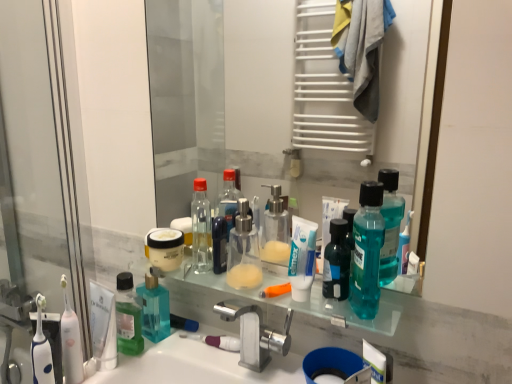
Question: From a real-world perspective, does transparent plastic screen door at left stand above white matte toothpaste at center?

Choices:
 (A) no
 (B) yes

Answer: (B)

Question: From the image's perspective, is transparent plastic screen door at left located above white matte toothpaste at center?

Choices:
 (A) no
 (B) yes

Answer: (B)

Question: Is the position of transparent plastic screen door at left more distant than that of white matte toothpaste at center?

Choices:
 (A) no
 (B) yes

Answer: (B)

Question: Is transparent plastic screen door at left turned away from white matte toothpaste at center?

Choices:
 (A) no
 (B) yes

Answer: (A)

Question: Is transparent plastic screen door at left next to white matte toothpaste at center and touching it?

Choices:
 (A) no
 (B) yes

Answer: (A)

Question: From a real-world perspective, is teal plastic mouthwash at center above or below silver metallic faucet at center?

Choices:
 (A) above
 (B) below

Answer: (A)

Question: Considering the positions of teal plastic mouthwash at center and silver metallic faucet at center in the image, is teal plastic mouthwash at center bigger or smaller than silver metallic faucet at center?

Choices:
 (A) small
 (B) big

Answer: (A)

Question: From the image's perspective, relative to silver metallic faucet at center, is teal plastic mouthwash at center above or below?

Choices:
 (A) below
 (B) above

Answer: (B)

Question: From their relative heights in the image, would you say teal plastic mouthwash at center is taller or shorter than silver metallic faucet at center?

Choices:
 (A) short
 (B) tall

Answer: (B)

Question: From a real-world perspective, is white glossy sink at lower center positioned above or below transparent glass mirror at center?

Choices:
 (A) above
 (B) below

Answer: (B)

Question: Looking at their shapes, would you say white glossy sink at lower center is wider or thinner than transparent glass mirror at center?

Choices:
 (A) thin
 (B) wide

Answer: (B)

Question: Relative to transparent glass mirror at center, is white glossy sink at lower center in front or behind?

Choices:
 (A) behind
 (B) front

Answer: (B)

Question: Would you say white glossy sink at lower center is inside or outside transparent glass mirror at center?

Choices:
 (A) inside
 (B) outside

Answer: (B)

Question: Which is correct: teal plastic mouthwash at center is inside transparent plastic screen door at left, or outside of it?

Choices:
 (A) outside
 (B) inside

Answer: (A)

Question: Considering the positions of teal plastic mouthwash at center and transparent plastic screen door at left in the image, is teal plastic mouthwash at center bigger or smaller than transparent plastic screen door at left?

Choices:
 (A) small
 (B) big

Answer: (A)